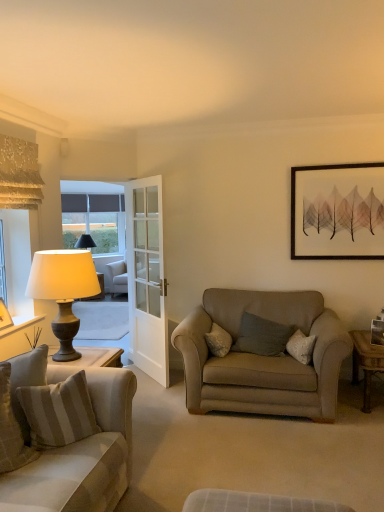
Question: Is striped fabric pillow at lower left, the first pillow viewed from the front, positioned in front of wooden desk at right?

Choices:
 (A) no
 (B) yes

Answer: (B)

Question: Is striped fabric pillow at lower left, marked as the 3th pillow in a right-to-left arrangement, bigger than wooden desk at right?

Choices:
 (A) no
 (B) yes

Answer: (A)

Question: Does striped fabric pillow at lower left, the first pillow viewed from the front, come behind wooden desk at right?

Choices:
 (A) no
 (B) yes

Answer: (A)

Question: Is the surface of striped fabric pillow at lower left, marked as the 3th pillow in a right-to-left arrangement, in direct contact with wooden desk at right?

Choices:
 (A) yes
 (B) no

Answer: (B)

Question: Can you confirm if striped fabric pillow at lower left, acting as the 1th pillow starting from the left, is thinner than wooden desk at right?

Choices:
 (A) no
 (B) yes

Answer: (B)

Question: Is striped fabric pillow at lower left, the first pillow viewed from the front, situated inside matte gray lamp at left or outside?

Choices:
 (A) outside
 (B) inside

Answer: (A)

Question: From their relative heights in the image, would you say striped fabric pillow at lower left, the first pillow viewed from the front, is taller or shorter than matte gray lamp at left?

Choices:
 (A) short
 (B) tall

Answer: (A)

Question: Is striped fabric pillow at lower left, acting as the 1th pillow starting from the left, to the left or to the right of matte gray lamp at left in the image?

Choices:
 (A) right
 (B) left

Answer: (B)

Question: Considering their positions, is striped fabric pillow at lower left, acting as the 3th pillow starting from the back, located in front of or behind matte gray lamp at left?

Choices:
 (A) front
 (B) behind

Answer: (A)

Question: Which is correct: soft gray cushion at center, the first pillow viewed from the right, is inside matte glass window at left, or outside of it?

Choices:
 (A) outside
 (B) inside

Answer: (A)

Question: From a real-world perspective, is soft gray cushion at center, the 3th pillow positioned from the left, positioned above or below matte glass window at left?

Choices:
 (A) above
 (B) below

Answer: (B)

Question: In terms of size, does soft gray cushion at center, the 3th pillow positioned from the left, appear bigger or smaller than matte glass window at left?

Choices:
 (A) small
 (B) big

Answer: (A)

Question: Is point (288, 334) closer or farther from the camera than point (64, 238)?

Choices:
 (A) closer
 (B) farther

Answer: (A)

Question: In terms of height, does striped fabric pillow at lower left, the first pillow viewed from the front, look taller or shorter compared to beige fabric couch at left?

Choices:
 (A) short
 (B) tall

Answer: (A)

Question: Is striped fabric pillow at lower left, the first pillow viewed from the front, inside the boundaries of beige fabric couch at left, or outside?

Choices:
 (A) inside
 (B) outside

Answer: (A)